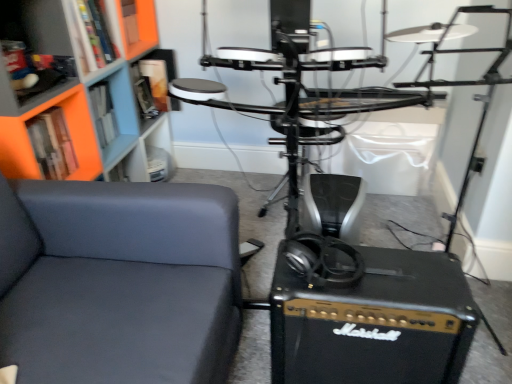
Question: Considering their positions, is matte black shelf at upper left, the 2th shelf viewed from the top, located in front of or behind orange matte bookshelf at upper left, which is the third shelf in top-to-bottom order?

Choices:
 (A) behind
 (B) front

Answer: (B)

Question: Is matte black shelf at upper left, arranged as the second shelf when ordered from the bottom, wider or thinner than orange matte bookshelf at upper left, which appears as the first shelf when ordered from the bottom?

Choices:
 (A) thin
 (B) wide

Answer: (B)

Question: Which object is the closest to the orange matte bookshelf at upper left, which ranks as the 1th shelf in top-to-bottom order?

Choices:
 (A) orange matte bookshelf at upper left, which appears as the first shelf when ordered from the bottom
 (B) matte black shelf at upper left, arranged as the second shelf when ordered from the bottom
 (C) matte gray chair at left
 (D) orange matte bookcase at upper left

Answer: (D)

Question: Which object is the farthest from the orange matte bookshelf at upper left, which ranks as the 1th shelf in top-to-bottom order?

Choices:
 (A) orange matte bookcase at upper left
 (B) matte gray chair at left
 (C) matte black shelf at upper left, arranged as the second shelf when ordered from the bottom
 (D) orange matte bookshelf at upper left, which is the third shelf in top-to-bottom order

Answer: (B)